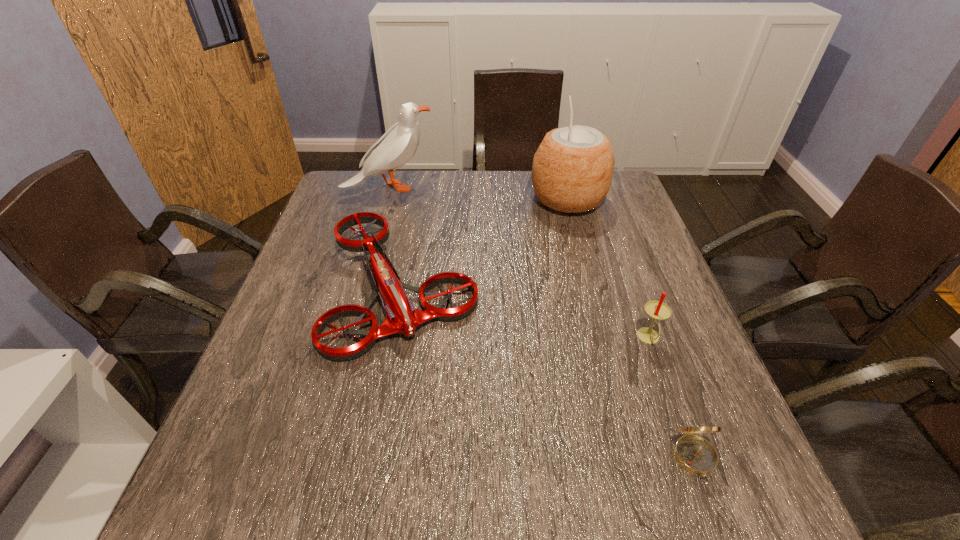
I want to click on coconut at the far edge, so click(572, 170).

In order to click on gull that is at the far edge in this screenshot , I will do `click(398, 145)`.

Identify the location of object present at the near edge. (696, 455).

Identify the location of gull at the left edge. (398, 145).

The image size is (960, 540). I want to click on drone situated at the left edge, so click(401, 316).

The width and height of the screenshot is (960, 540). Find the location of `coconut present at the right edge`. coconut present at the right edge is located at coordinates (572, 170).

The image size is (960, 540). Find the location of `candle that is at the right edge`. candle that is at the right edge is located at coordinates pos(657,310).

At what (x,y) coordinates should I click in order to perform the action: click on compass situated at the right edge. Please return your answer as a coordinate pair (x, y). Looking at the image, I should click on (696, 455).

This screenshot has height=540, width=960. What are the coordinates of `object that is at the far left corner` in the screenshot? It's located at (398, 145).

Locate an element on the screen. The image size is (960, 540). object that is at the far right corner is located at coordinates (572, 170).